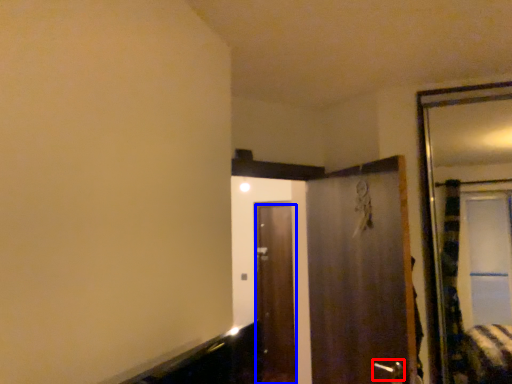
Question: Which object is further to the camera taking this photo, door handle (highlighted by a red box) or door (highlighted by a blue box)?

Choices:
 (A) door handle
 (B) door

Answer: (B)